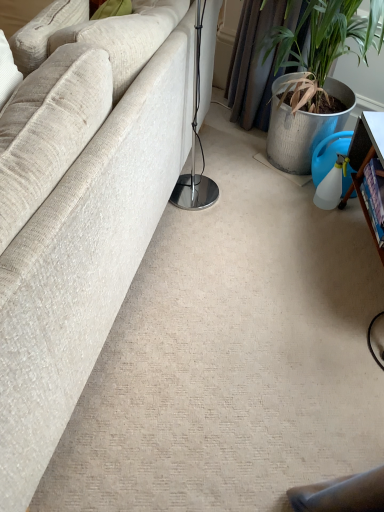
Question: Is wooden bookshelf at right inside or outside of beige fabric couch at left?

Choices:
 (A) inside
 (B) outside

Answer: (B)

Question: From a real-world perspective, is wooden bookshelf at right above or below beige fabric couch at left?

Choices:
 (A) below
 (B) above

Answer: (A)

Question: From the image's perspective, is wooden bookshelf at right above or below beige fabric couch at left?

Choices:
 (A) below
 (B) above

Answer: (A)

Question: Considering the positions of beige fabric couch at left and wooden bookshelf at right in the image, is beige fabric couch at left taller or shorter than wooden bookshelf at right?

Choices:
 (A) tall
 (B) short

Answer: (A)

Question: From the image's perspective, is beige fabric couch at left positioned above or below wooden bookshelf at right?

Choices:
 (A) below
 (B) above

Answer: (B)

Question: From a real-world perspective, is beige fabric couch at left above or below wooden bookshelf at right?

Choices:
 (A) above
 (B) below

Answer: (A)

Question: Visually, is beige fabric couch at left positioned to the left or to the right of wooden bookshelf at right?

Choices:
 (A) left
 (B) right

Answer: (A)